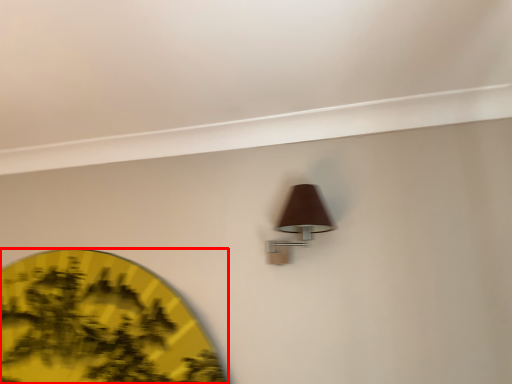
Question: From the image's perspective, considering the relative positions of circle (annotated by the red box) and lamp in the image provided, where is circle (annotated by the red box) located with respect to the staircase?

Choices:
 (A) above
 (B) below

Answer: (B)